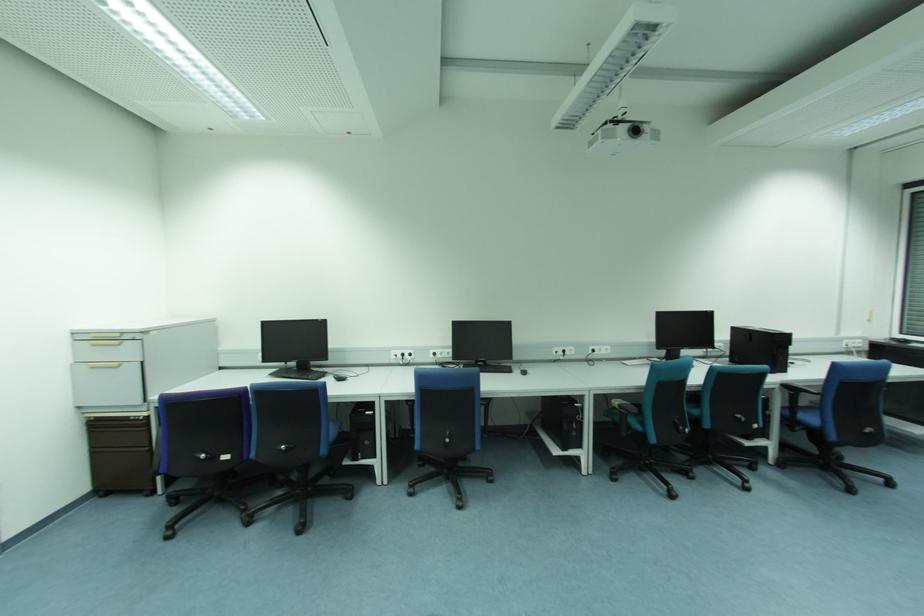
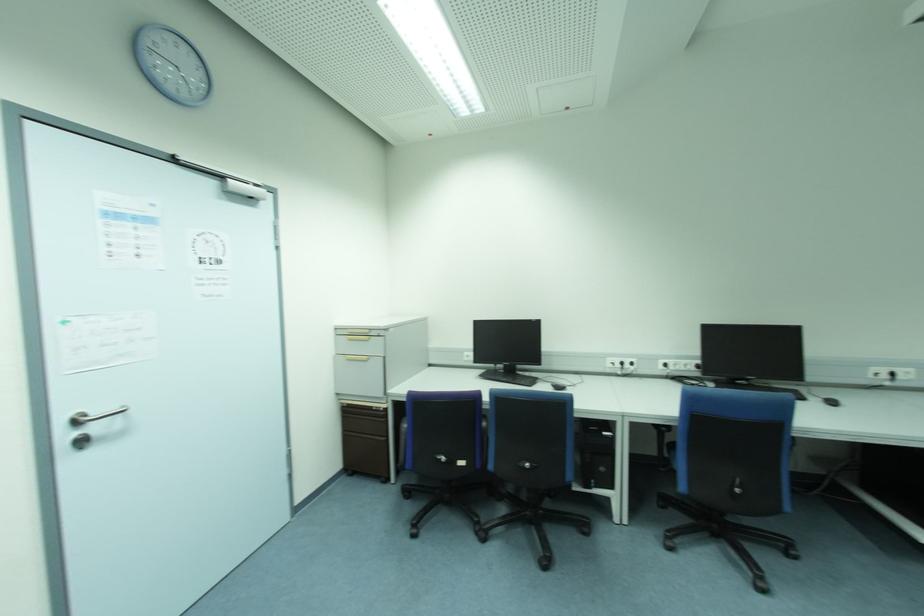
Question: In a continuous first-person perspective shot, in which direction is the camera moving?

Choices:
 (A) Left
 (B) Right
 (C) Forward
 (D) Backward

Answer: (A)